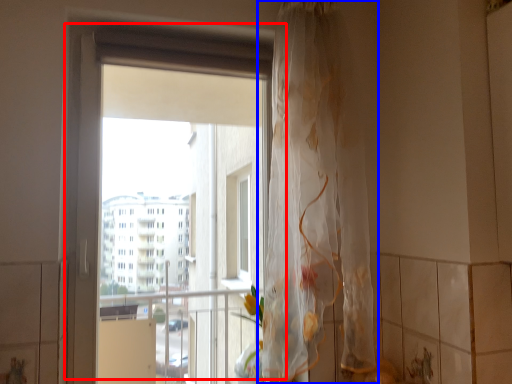
Question: Among these objects, which one is farthest to the camera, window (highlighted by a red box) or curtain (highlighted by a blue box)?

Choices:
 (A) window
 (B) curtain

Answer: (A)